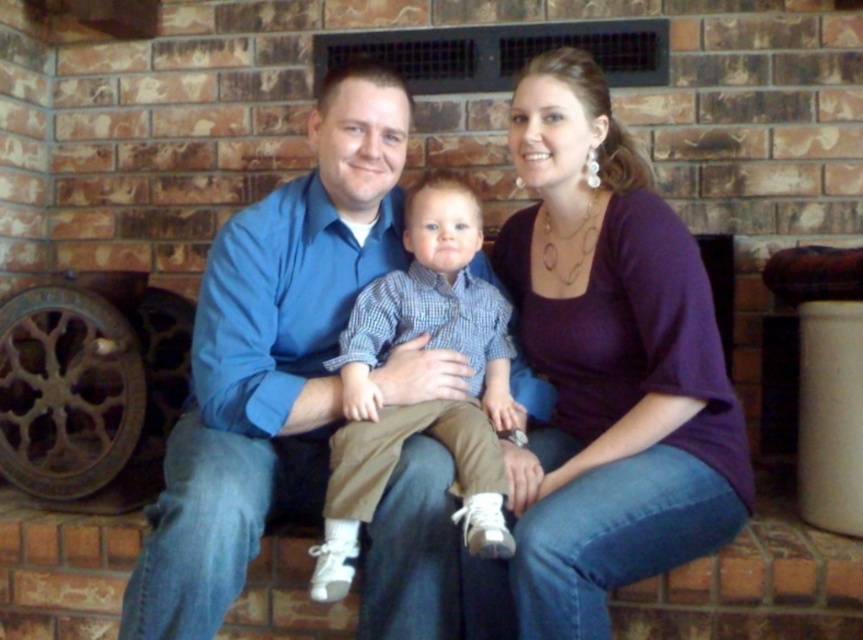
Question: Is purple soft shirt at center to the left of blue cotton shirt at center from the viewer's perspective?

Choices:
 (A) yes
 (B) no

Answer: (B)

Question: Which of the following is the closest to the observer?

Choices:
 (A) purple soft shirt at center
 (B) blue cotton shirt at center

Answer: (A)

Question: Which object appears closest to the camera in this image?

Choices:
 (A) matte blue shirt at center
 (B) purple soft shirt at center

Answer: (B)

Question: Is matte blue shirt at center closer to the viewer compared to blue cotton shirt at center?

Choices:
 (A) yes
 (B) no

Answer: (A)

Question: Among these points, which one is nearest to the camera?

Choices:
 (A) tap(628, 419)
 (B) tap(320, 332)

Answer: (A)

Question: Is purple soft shirt at center below blue cotton shirt at center?

Choices:
 (A) yes
 (B) no

Answer: (B)